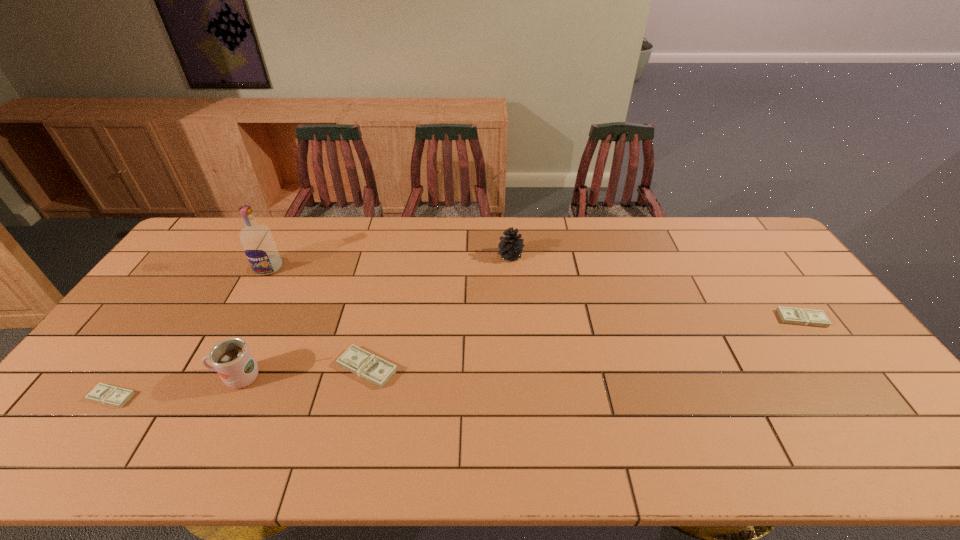
Where is `blank space located on the back of the shortest object`? blank space located on the back of the shortest object is located at coordinates (135, 363).

I want to click on blank area located on the right of the tallest money, so click(470, 368).

Where is `vacant point located on the front of the second shortest object`? vacant point located on the front of the second shortest object is located at coordinates (856, 394).

Find the location of `vacant region located 0.250m on the left of the second object from right to left`. vacant region located 0.250m on the left of the second object from right to left is located at coordinates (x=424, y=256).

The width and height of the screenshot is (960, 540). Find the location of `blank space located 0.340m on the label of the vodka`. blank space located 0.340m on the label of the vodka is located at coordinates (217, 362).

Locate an element on the screen. This screenshot has width=960, height=540. free space located 0.130m on the side with the handle of the cup is located at coordinates (162, 378).

What are the coordinates of `vacant space located on the side with the handle of the cup` in the screenshot? It's located at (104, 378).

Find the location of `vacant position located 0.170m on the side with the handle of the cup`. vacant position located 0.170m on the side with the handle of the cup is located at coordinates (147, 378).

What are the coordinates of `object located in the far edge section of the desktop` in the screenshot? It's located at (510, 247).

Identify the location of money that is at the near edge. Image resolution: width=960 pixels, height=540 pixels. (110, 395).